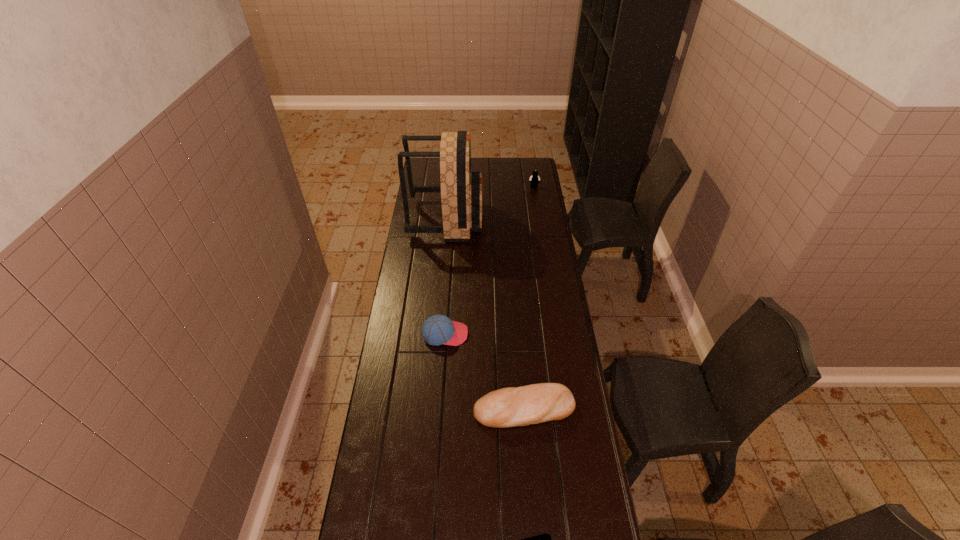
Find the location of `unoccupied area between the fourth nearest object and the baseball cap`. unoccupied area between the fourth nearest object and the baseball cap is located at coordinates (445, 276).

Locate an element on the screen. free space that is in between the third nearest object and the second tallest object is located at coordinates (490, 261).

I want to click on free space that is in between the backpack and the third nearest object, so click(445, 276).

Identify the location of unoccupied position between the backpack and the farthest object. (491, 203).

Locate an element on the screen. The image size is (960, 540). free space between the second nearest object and the baseball cap is located at coordinates (485, 371).

I want to click on vacant space that's between the farthest object and the baseball cap, so click(x=490, y=261).

Identify the location of object that is the second nearest to the fourth farthest object. The image size is (960, 540). (545, 539).

Where is `object that stands as the fourth closest to the bread`? Image resolution: width=960 pixels, height=540 pixels. object that stands as the fourth closest to the bread is located at coordinates (534, 179).

At what (x,y) coordinates should I click in order to perform the action: click on free space that satisfies the following two spatial constraints: 1. on the front-facing side of the farthest object; 2. on the front face of the tallest object. Please return your answer as a coordinate pair (x, y). This screenshot has width=960, height=540. Looking at the image, I should click on (539, 219).

This screenshot has width=960, height=540. Identify the location of vacant space that satisfies the following two spatial constraints: 1. on the front-facing side of the farthest object; 2. on the front-facing side of the third farthest object. pos(557,334).